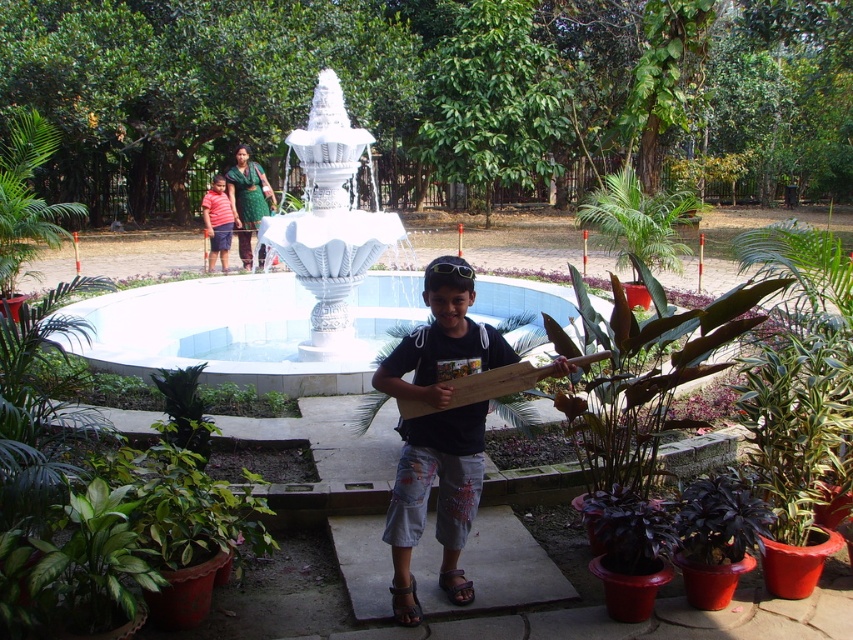
Question: Based on their relative distances, which object is nearer to the striped cotton shirt at left?

Choices:
 (A) dark blue t-shirt at center
 (B) white glossy fountain at center
 (C) green leafy plant at center

Answer: (B)

Question: Among these points, which one is farthest from the camera?

Choices:
 (A) (621, 196)
 (B) (219, 323)
 (C) (421, 369)

Answer: (B)

Question: Does white glossy fountain at center have a lesser width compared to dark blue t-shirt at center?

Choices:
 (A) no
 (B) yes

Answer: (A)

Question: Does white glossy fountain at center have a smaller size compared to green leafy plant at center?

Choices:
 (A) yes
 (B) no

Answer: (A)

Question: Can you confirm if white glossy fountain at center is positioned to the right of green leafy plant at center?

Choices:
 (A) no
 (B) yes

Answer: (A)

Question: Which point is closer to the camera?

Choices:
 (A) (410, 468)
 (B) (653, 248)
 (C) (312, 285)

Answer: (A)